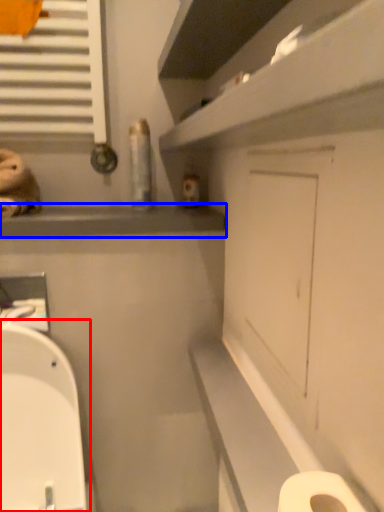
Question: Which point is closer to the camera, toilet (highlighted by a red box) or window sill (highlighted by a blue box)?

Choices:
 (A) toilet
 (B) window sill

Answer: (A)